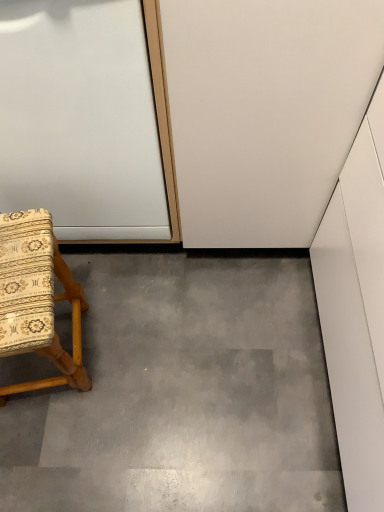
The height and width of the screenshot is (512, 384). Find the location of `vacant area that lies to the right of wooden-patterned fabric chair at lower left`. vacant area that lies to the right of wooden-patterned fabric chair at lower left is located at coordinates (145, 345).